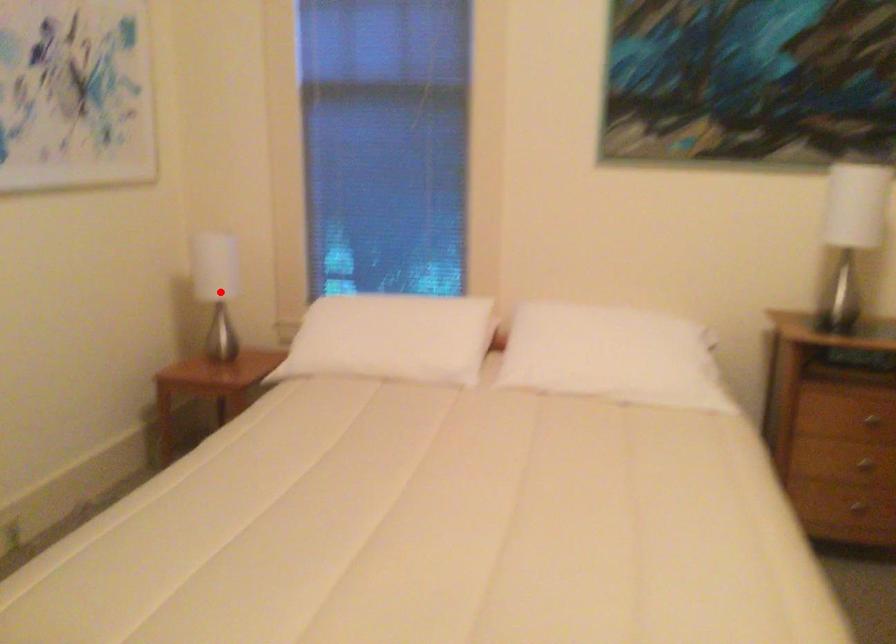
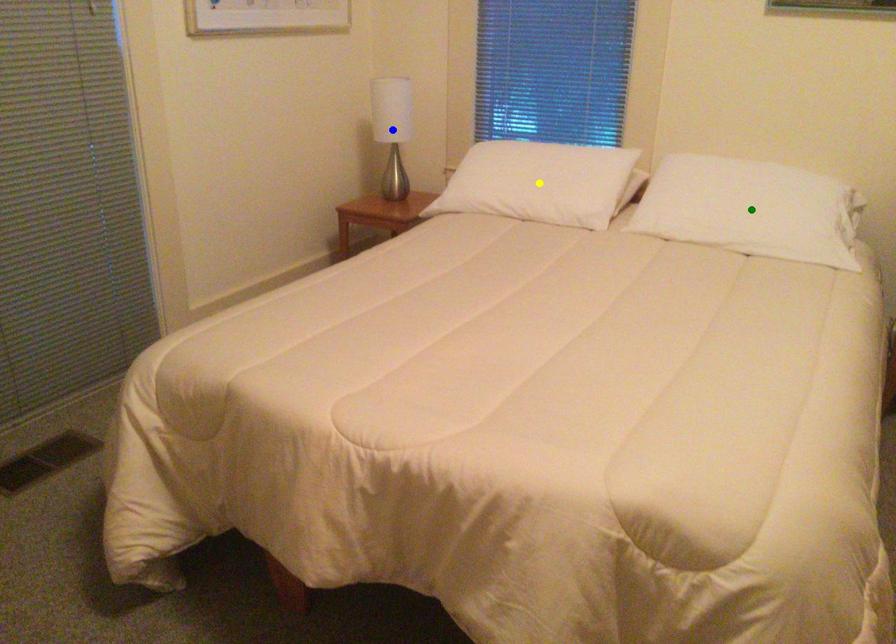
Question: I am providing you with two images of the same scene from different viewpoints. A red point is marked on the first image. You are given multiple points on the second image. In image 2, which mark is for the same physical point as the one in image 1?

Choices:
 (A) green point
 (B) blue point
 (C) yellow point

Answer: (B)